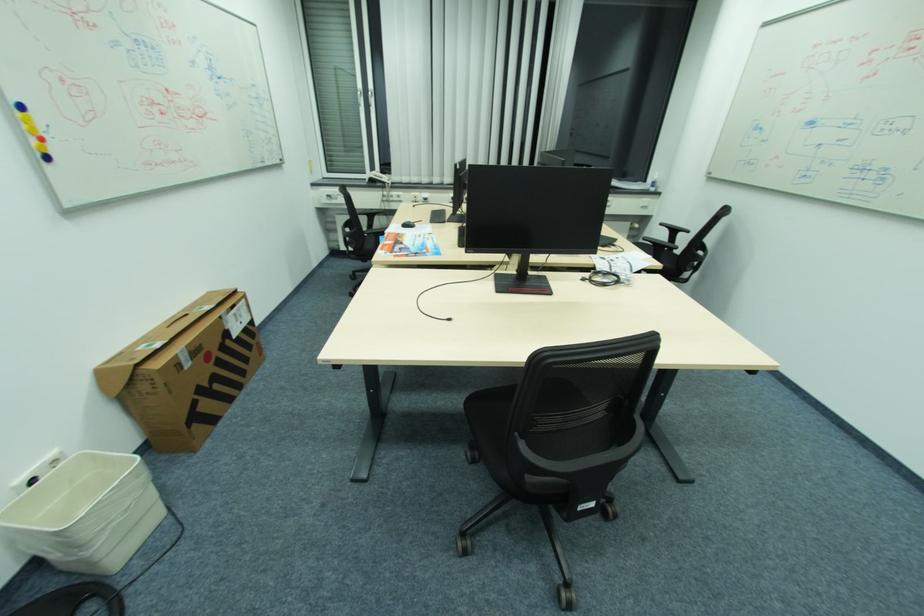
The height and width of the screenshot is (616, 924). What do you see at coordinates (177, 323) in the screenshot?
I see `the cardboard box handle` at bounding box center [177, 323].